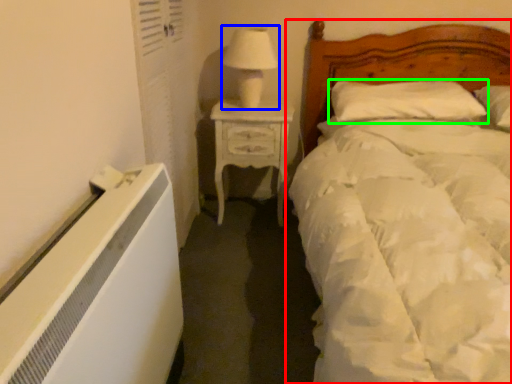
Question: Which object is positioned closest to bed (highlighted by a red box)? Select from table lamp (highlighted by a blue box) and pillow (highlighted by a green box).

Choices:
 (A) table lamp
 (B) pillow

Answer: (B)